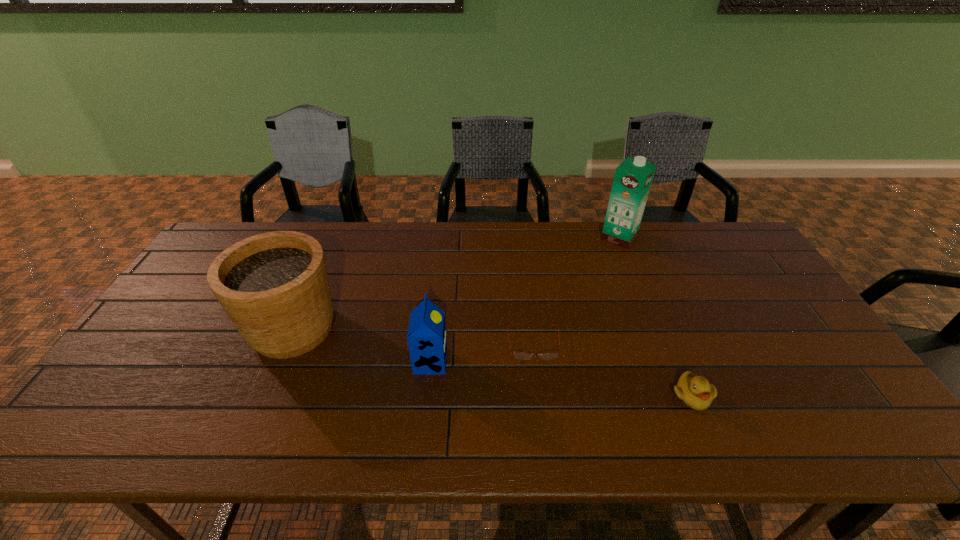
Image resolution: width=960 pixels, height=540 pixels. Find the location of `unoccupied position between the leftmost object and the right carton`. unoccupied position between the leftmost object and the right carton is located at coordinates (456, 283).

This screenshot has width=960, height=540. I want to click on free space between the third tallest object and the farther carton, so click(525, 300).

This screenshot has width=960, height=540. In order to click on vacant space that's between the farthest object and the nearer carton in this screenshot , I will do `click(525, 300)`.

The height and width of the screenshot is (540, 960). I want to click on object that is the second closest to the flowerpot, so click(x=518, y=355).

Locate which object ranks in proximity to the flowerpot. Please provide its 2D coordinates. Your answer should be formatted as a tuple, i.e. [(x, y)], where the tuple contains the x and y coordinates of a point satisfying the conditions above.

[(426, 336)]

Where is `vacant region that satisfies the following two spatial constraints: 1. on the back side of the flowerpot; 2. on the right side of the farther carton`? This screenshot has width=960, height=540. vacant region that satisfies the following two spatial constraints: 1. on the back side of the flowerpot; 2. on the right side of the farther carton is located at coordinates (332, 238).